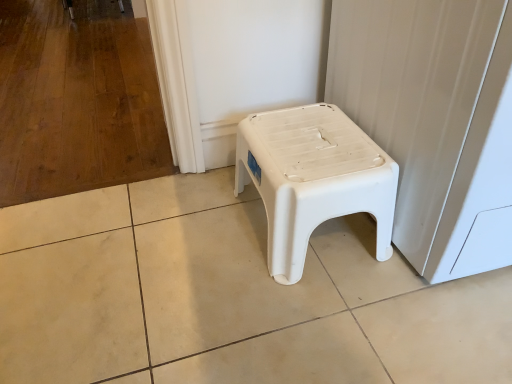
Question: From a real-world perspective, is white plastic stool at center physically located above or below white plastic stool at lower right?

Choices:
 (A) above
 (B) below

Answer: (B)

Question: Is white plastic stool at center in front of or behind white plastic stool at lower right in the image?

Choices:
 (A) front
 (B) behind

Answer: (B)

Question: Looking at the image, does white plastic stool at center seem bigger or smaller compared to white plastic stool at lower right?

Choices:
 (A) big
 (B) small

Answer: (B)

Question: Considering the relative positions of white plastic stool at lower right and white plastic stool at center in the image provided, is white plastic stool at lower right to the left or to the right of white plastic stool at center?

Choices:
 (A) left
 (B) right

Answer: (B)

Question: Is white plastic stool at lower right inside the boundaries of white plastic stool at center, or outside?

Choices:
 (A) outside
 (B) inside

Answer: (A)

Question: Is white plastic stool at lower right bigger or smaller than white plastic stool at center?

Choices:
 (A) small
 (B) big

Answer: (B)

Question: From the image's perspective, is white plastic stool at lower right located above or below white plastic stool at center?

Choices:
 (A) below
 (B) above

Answer: (B)